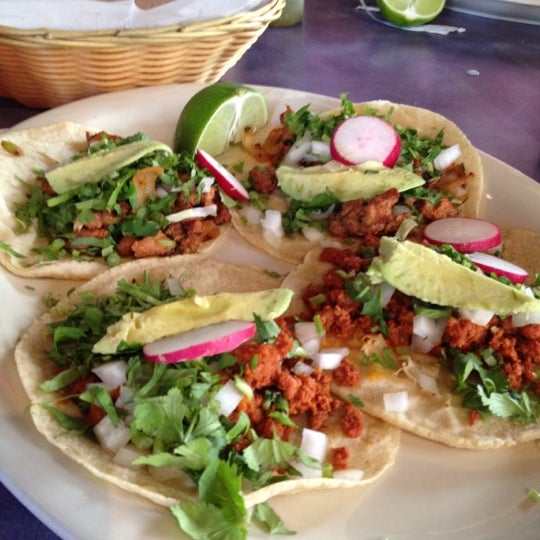
The width and height of the screenshot is (540, 540). In order to click on bottle in this screenshot , I will do `click(296, 10)`.